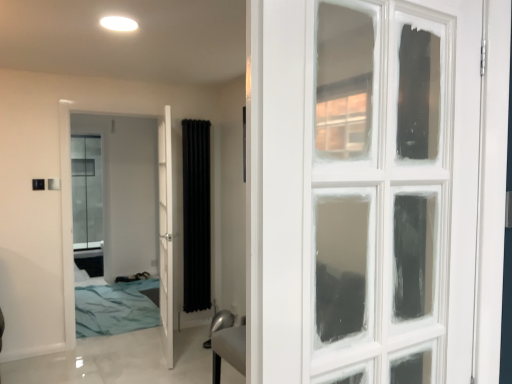
Question: Looking at the image, does white glossy door at center, which ranks as the 1th door in right-to-left order, seem bigger or smaller compared to white glossy door at center, acting as the second door starting from the right?

Choices:
 (A) small
 (B) big

Answer: (B)

Question: From a real-world perspective, is white glossy door at center, which appears as the 2th door when viewed from the left, physically located above or below white glossy door at center, acting as the second door starting from the right?

Choices:
 (A) above
 (B) below

Answer: (B)

Question: Based on their relative distances, which object is nearer to the white glossy door at center, the first door when ordered from left to right?

Choices:
 (A) black fabric radiator at center
 (B) white glossy door at center, which ranks as the 1th door in right-to-left order

Answer: (B)

Question: Considering the real-world distances, which object is closest to the white glossy door at center, which appears as the 2th door when viewed from the left?

Choices:
 (A) black fabric radiator at center
 (B) white glossy door at center, acting as the second door starting from the right

Answer: (B)